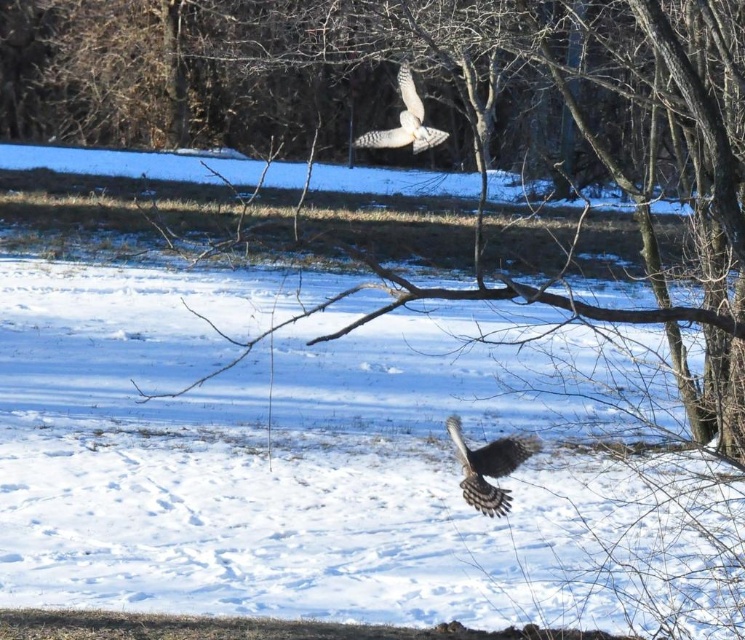
Can you confirm if speckled brown hawk at center is positioned to the right of white speckled feathers at upper center?

Result: Yes, speckled brown hawk at center is to the right of white speckled feathers at upper center.

Is point (485, 445) less distant than point (396, 145)?

No, (485, 445) is further to viewer.

Is point (475, 497) farther from viewer compared to point (399, 131)?

Yes, it is.

Find the location of a particular element. This screenshot has width=745, height=640. speckled brown hawk at center is located at coordinates (x=488, y=467).